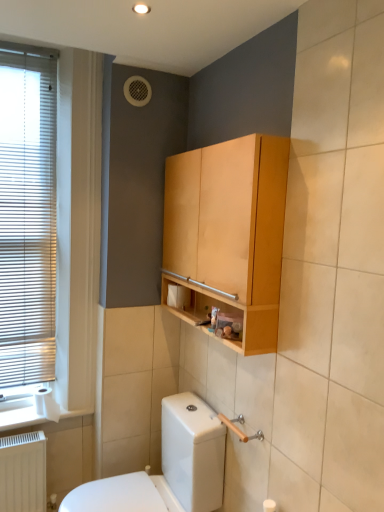
Question: In terms of width, does white glossy toilet at lower left look wider or thinner when compared to white matte toilet paper at lower center, which is the 1th toilet paper in top-to-bottom order?

Choices:
 (A) wide
 (B) thin

Answer: (A)

Question: Would you say white glossy toilet at lower left is to the left or to the right of white matte toilet paper at lower center, acting as the first toilet paper starting from the right, in the picture?

Choices:
 (A) left
 (B) right

Answer: (A)

Question: Which is farther from the metallic silver toiletries at center?

Choices:
 (A) white glossy toilet at lower left
 (B) light brown wood cabinet at upper center
 (C) white blinds at left
 (D) white matte toilet paper at lower left, the 2th toilet paper from the right
 (E) white matte toilet paper at lower center, which is counted as the second toilet paper, starting from the left

Answer: (C)

Question: Which is nearer to the white blinds at left?

Choices:
 (A) white matte toilet paper at lower center, which is the second toilet paper from bottom to top
 (B) light brown wood cabinet at upper center
 (C) white matte toilet paper at lower left, the first toilet paper in the left-to-right sequence
 (D) metallic silver toiletries at center
 (E) white glossy toilet at lower left

Answer: (C)